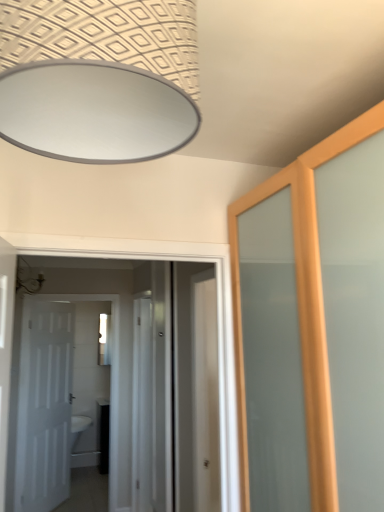
Question: Is white glossy door at center, the second door viewed from the left, beside white glossy door at left, the 1th door viewed from the left?

Choices:
 (A) no
 (B) yes

Answer: (A)

Question: Are white glossy door at center, the first door viewed from the right, and white glossy door at left, the 1th door viewed from the left, located far from each other?

Choices:
 (A) no
 (B) yes

Answer: (A)

Question: Does white glossy door at center, the second door viewed from the left, have a greater height compared to white glossy door at left, the first door viewed from the back?

Choices:
 (A) yes
 (B) no

Answer: (B)

Question: Does white glossy door at center, which appears as the first door when viewed from the front, have a lesser width compared to white glossy door at left, the second door when ordered from right to left?

Choices:
 (A) no
 (B) yes

Answer: (A)

Question: Can you confirm if white glossy door at center, acting as the 2th door starting from the back, is smaller than white glossy door at left, the 1th door viewed from the left?

Choices:
 (A) yes
 (B) no

Answer: (A)

Question: Would you say white glossy door at center, the first door viewed from the right, contains white glossy door at left, the second door when ordered from right to left?

Choices:
 (A) no
 (B) yes

Answer: (A)

Question: Is white glossy door at left, arranged as the second door when viewed from the front, further to camera compared to clear glass mirror at center?

Choices:
 (A) yes
 (B) no

Answer: (B)

Question: Does white glossy door at left, the first door viewed from the back, have a lesser height compared to clear glass mirror at center?

Choices:
 (A) yes
 (B) no

Answer: (B)

Question: Is white glossy door at left, arranged as the second door when viewed from the front, next to clear glass mirror at center?

Choices:
 (A) no
 (B) yes

Answer: (A)

Question: Could clear glass mirror at center be considered to be inside white glossy door at left, the first door viewed from the back?

Choices:
 (A) yes
 (B) no

Answer: (B)

Question: Does white glossy door at left, the first door viewed from the back, appear on the left side of clear glass mirror at center?

Choices:
 (A) no
 (B) yes

Answer: (A)

Question: From the image's perspective, is white glossy door at left, arranged as the second door when viewed from the front, on top of clear glass mirror at center?

Choices:
 (A) yes
 (B) no

Answer: (B)

Question: Does clear glass screen door at center lie behind white glossy door at left, the first door viewed from the back?

Choices:
 (A) no
 (B) yes

Answer: (A)